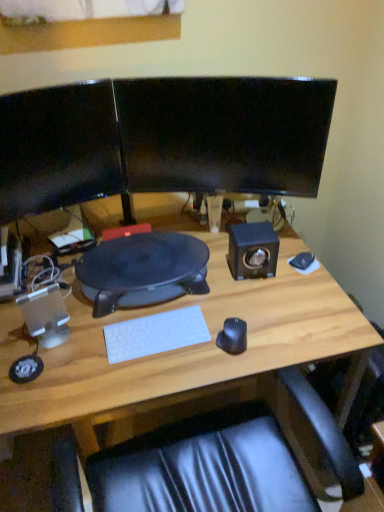
You are a GUI agent. You are given a task and a screenshot of the screen. Output one action in this format:
    pyautogui.click(x=<x>, y=<y>)
    Task: Click on the free spot in front of white matte keyboard at center
    This screenshot has width=384, height=512.
    Given the screenshot: What is the action you would take?
    pyautogui.click(x=145, y=376)